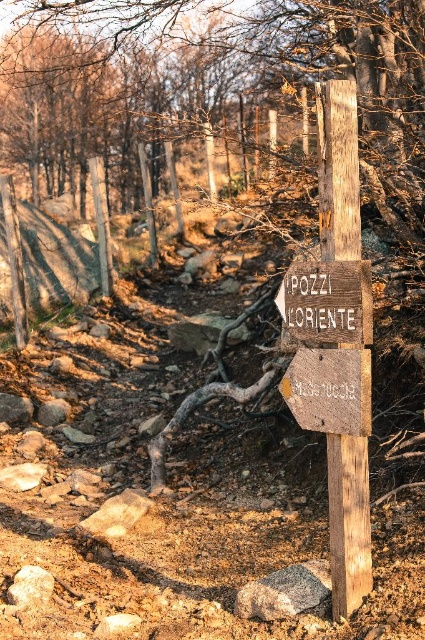
Describe the element at coordinates (326, 304) in the screenshot. I see `wooden sign at center` at that location.

Is point (286, 273) closer to camera compared to point (314, 403)?

No, (286, 273) is further to viewer.

The height and width of the screenshot is (640, 425). I want to click on wooden sign at center, so click(x=326, y=304).

Does point (354, 605) come farther from viewer compared to point (331, 374)?

Yes, point (354, 605) is behind point (331, 374).

Can you confirm if wooden signpost at center-right is positioned below weathered wood sign at center?

Yes.

Between point (342, 109) and point (306, 349), which one is positioned in front?

Point (342, 109) is more forward.

The image size is (425, 640). What are the coordinates of `wooden signpost at center-right` in the screenshot? It's located at (337, 170).

Can you confirm if wooden signpost at center-right is wider than wooden sign at center?

No, wooden signpost at center-right is not wider than wooden sign at center.

Which is above, wooden signpost at center-right or wooden sign at center?

wooden sign at center is higher up.

Does point (337, 83) come in front of point (306, 292)?

Yes, point (337, 83) is closer to viewer.

Locate an element on the screen. The width and height of the screenshot is (425, 640). wooden signpost at center-right is located at coordinates (337, 170).